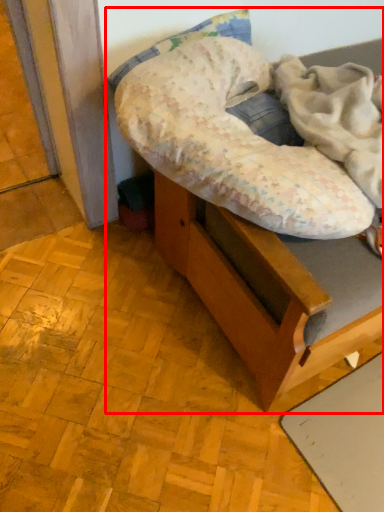
Question: Where is furniture (annotated by the red box) located in relation to blanket in the image?

Choices:
 (A) left
 (B) right

Answer: (B)